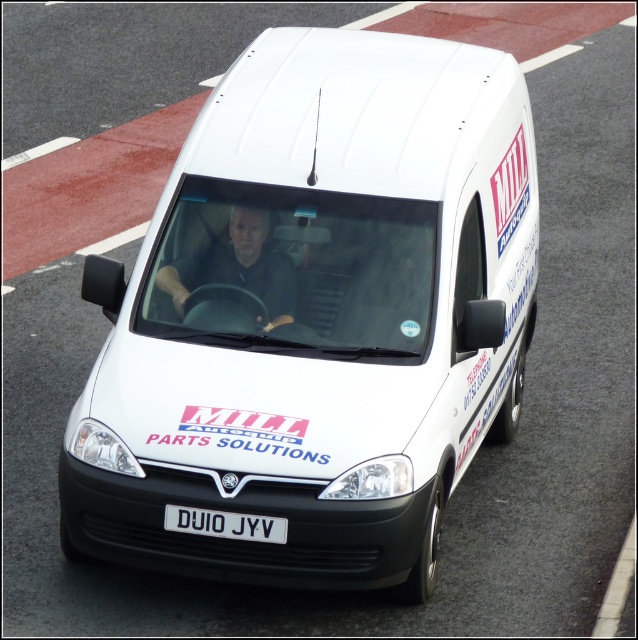
Does white matte van at center have a greater width compared to matte black steering wheel at center?

Indeed, white matte van at center has a greater width compared to matte black steering wheel at center.

Between white matte van at center and matte black steering wheel at center, which one has less height?

Standing shorter between the two is matte black steering wheel at center.

Does point (260, 316) lie in front of point (253, 285)?

Yes, point (260, 316) is closer to viewer.

Identify the location of white matte van at center. [x=315, y=316].

I want to click on white matte van at center, so click(x=315, y=316).

Does white matte van at center have a greater height compared to white plastic license plate at center?

Indeed, white matte van at center has a greater height compared to white plastic license plate at center.

Who is more distant from viewer, (389, 268) or (193, 522)?

Point (389, 268)

This screenshot has height=640, width=638. In order to click on white matte van at center in this screenshot , I will do `click(315, 316)`.

Can you confirm if matte black steering wheel at center is taller than white plastic license plate at center?

Yes.

Who is shorter, matte black steering wheel at center or white plastic license plate at center?

With less height is white plastic license plate at center.

Measure the distance between matte black steering wheel at center and camera.

A distance of 7.23 meters exists between matte black steering wheel at center and camera.

I want to click on matte black steering wheel at center, so click(237, 268).